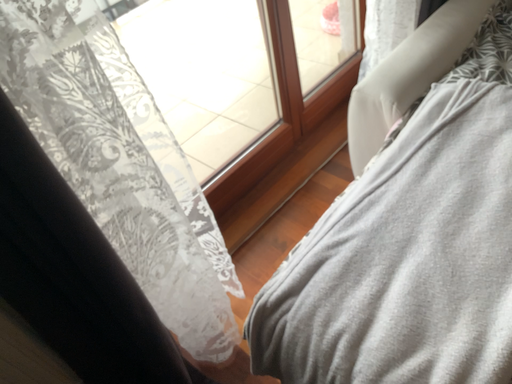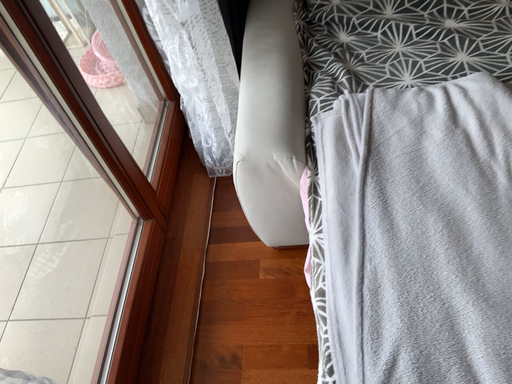
Question: How did the camera likely rotate when shooting the video?

Choices:
 (A) rotated upward
 (B) rotated downward

Answer: (A)